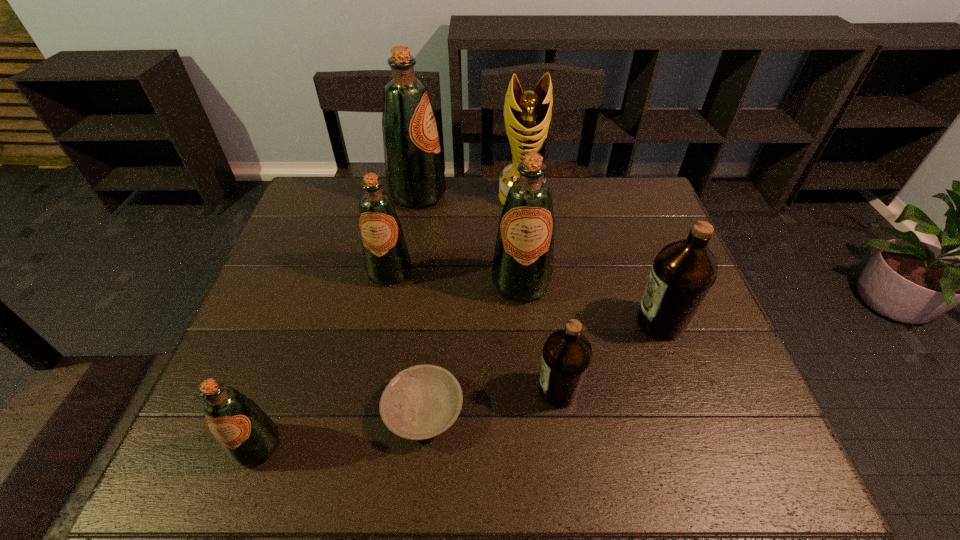
Locate an element on the screen. vacant area located on the label of the nearer brown olive oil is located at coordinates (420, 390).

Identify the location of free space located on the label of the nearer brown olive oil. Image resolution: width=960 pixels, height=540 pixels. (475, 390).

At what (x,y) coordinates should I click in order to perform the action: click on free space located on the label of the nearer brown olive oil. Please return your answer as a coordinate pair (x, y). Looking at the image, I should click on (424, 390).

This screenshot has height=540, width=960. Find the location of `vacant space located 0.160m on the back of the shortest object`. vacant space located 0.160m on the back of the shortest object is located at coordinates (432, 319).

At what (x,y) coordinates should I click in order to perform the action: click on olive oil present at the far edge. Please return your answer as a coordinate pair (x, y). This screenshot has height=540, width=960. Looking at the image, I should click on (x=415, y=178).

Identify the location of award situated at the far edge. 527,115.

You are a GUI agent. You are given a task and a screenshot of the screen. Output one action in this format:
    pyautogui.click(x=<x>, y=<y>)
    Task: Click on the olive oil that is at the near edge
    This screenshot has height=540, width=960.
    Given the screenshot: What is the action you would take?
    pyautogui.click(x=248, y=436)

The image size is (960, 540). Identify the location of bowl situated at the near edge. (421, 402).

Locate an element on the screen. This screenshot has width=960, height=540. object located in the left edge section of the desktop is located at coordinates (248, 436).

Locate an element on the screen. This screenshot has width=960, height=540. object located at the right edge is located at coordinates (683, 272).